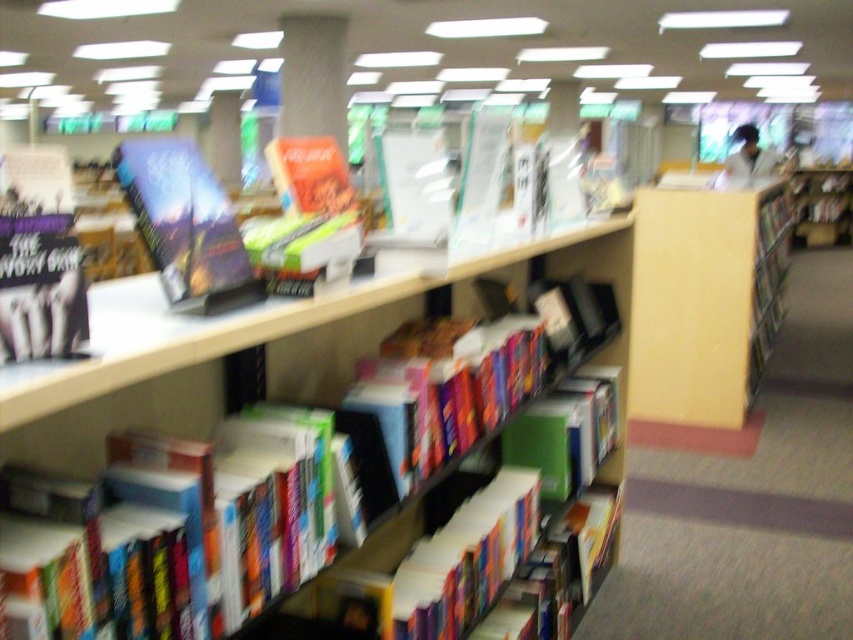
Is yellow matte bookshelf at center thinner than hardcover book at upper left?

Incorrect, yellow matte bookshelf at center's width is not less than hardcover book at upper left's.

Is yellow matte bookshelf at center to the left of hardcover book at upper left from the viewer's perspective?

No, yellow matte bookshelf at center is not to the left of hardcover book at upper left.

Between point (738, 211) and point (180, 227), which one is positioned in front?

Point (180, 227) is in front.

At what (x,y) coordinates should I click in order to perform the action: click on yellow matte bookshelf at center. Please return your answer as a coordinate pair (x, y). Looking at the image, I should click on tap(704, 300).

Which of these two, yellow matte bookshelf at center or hardcover book at left, stands shorter?

Standing shorter between the two is hardcover book at left.

Is yellow matte bookshelf at center closer to camera compared to hardcover book at left?

That is False.

Is point (747, 228) positioned behind point (33, 280)?

Yes, it is.

This screenshot has height=640, width=853. I want to click on yellow matte bookshelf at center, so click(x=704, y=300).

Between hardcover book at left and hardcover books at center, which one is positioned lower?

hardcover books at center is below.

Which is behind, point (70, 328) or point (248, 321)?

Point (248, 321)

In order to click on hardcover book at left in this screenshot , I will do `click(38, 257)`.